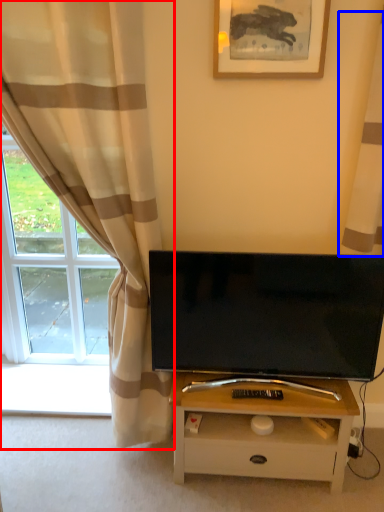
Question: Which object is further to the camera taking this photo, curtain (highlighted by a red box) or curtain (highlighted by a blue box)?

Choices:
 (A) curtain
 (B) curtain

Answer: (B)